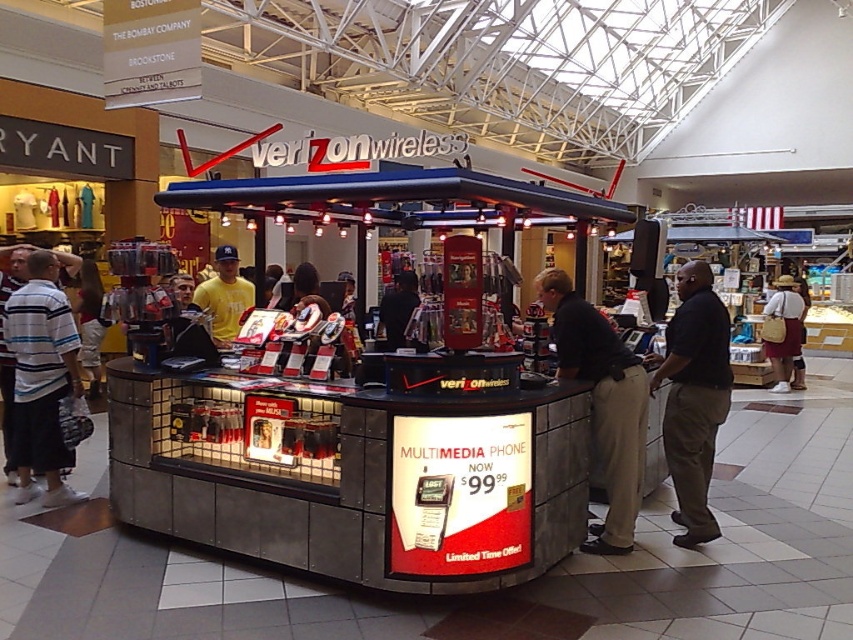
Question: Among these points, which one is nearest to the camera?

Choices:
 (A) (695, 356)
 (B) (230, 278)
 (C) (393, 337)
 (D) (622, 497)

Answer: (D)

Question: Is the position of black smooth shirt at right less distant than that of yellow t-shirt at center?

Choices:
 (A) no
 (B) yes

Answer: (B)

Question: Is black smooth shirt at right thinner than yellow t-shirt at center?

Choices:
 (A) yes
 (B) no

Answer: (A)

Question: Can you confirm if dark brown pants at center is thinner than black smooth shirt at right?

Choices:
 (A) no
 (B) yes

Answer: (A)

Question: Which point appears closest to the camera in this image?

Choices:
 (A) (685, 440)
 (B) (38, 476)

Answer: (A)

Question: Which of the following is the farthest from the observer?

Choices:
 (A) (585, 547)
 (B) (767, 308)

Answer: (B)